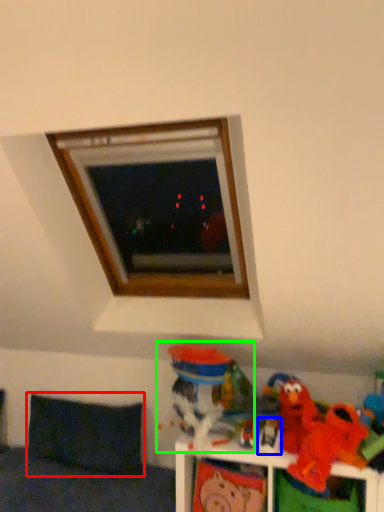
Question: Based on their relative distances, which object is nearer to pillow (highlighted by a red box)? Choose from toy (highlighted by a blue box) and toy (highlighted by a green box).

Choices:
 (A) toy
 (B) toy

Answer: (B)